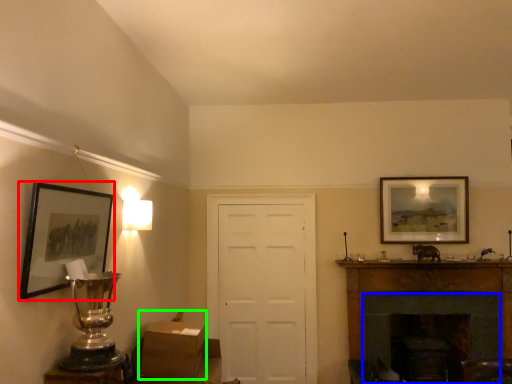
Question: Estimate the real-world distances between objects in this image. Which object is farther from picture frame (highlighted by a red box), fireplace (highlighted by a blue box) or cardboard box (highlighted by a green box)?

Choices:
 (A) fireplace
 (B) cardboard box

Answer: (A)